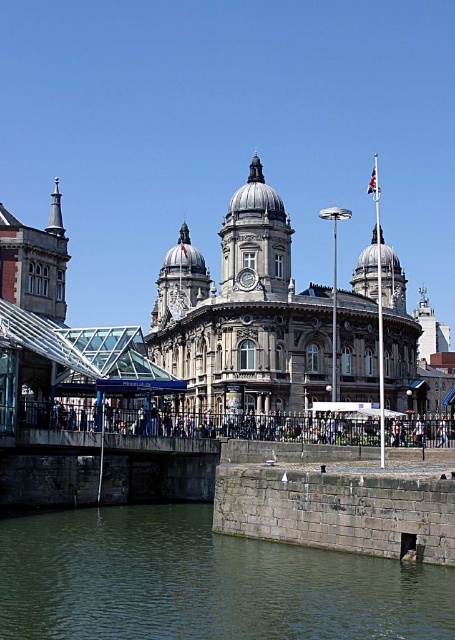
Is stone clock tower at center positioned at the back of polished stone clock tower at center?

No.

You are a GUI agent. You are given a task and a screenshot of the screen. Output one action in this format:
    pyautogui.click(x=<x>, y=<y>)
    Task: Click on the stone clock tower at center
    
    Given the screenshot: What is the action you would take?
    tap(243, 314)

Looking at this image, does greenish stone water at lower left have a smaller size compared to stone clock tower at center?

Yes, greenish stone water at lower left is smaller than stone clock tower at center.

Is greenish stone water at lower left positioned behind stone clock tower at center?

No, it is in front of stone clock tower at center.

Between point (345, 554) and point (389, 346), which one is positioned in front?

Point (345, 554) is more forward.

Where is `greenish stone water at lower left`? greenish stone water at lower left is located at coordinates (202, 582).

Who is more distant from viewer, (x=56, y=522) or (x=141, y=444)?

The point (x=141, y=444) is more distant.

Can you confirm if greenish stone water at lower left is positioned to the left of concrete bridge at center?

In fact, greenish stone water at lower left is to the right of concrete bridge at center.

The image size is (455, 640). What are the coordinates of `greenish stone water at lower left` in the screenshot? It's located at (202, 582).